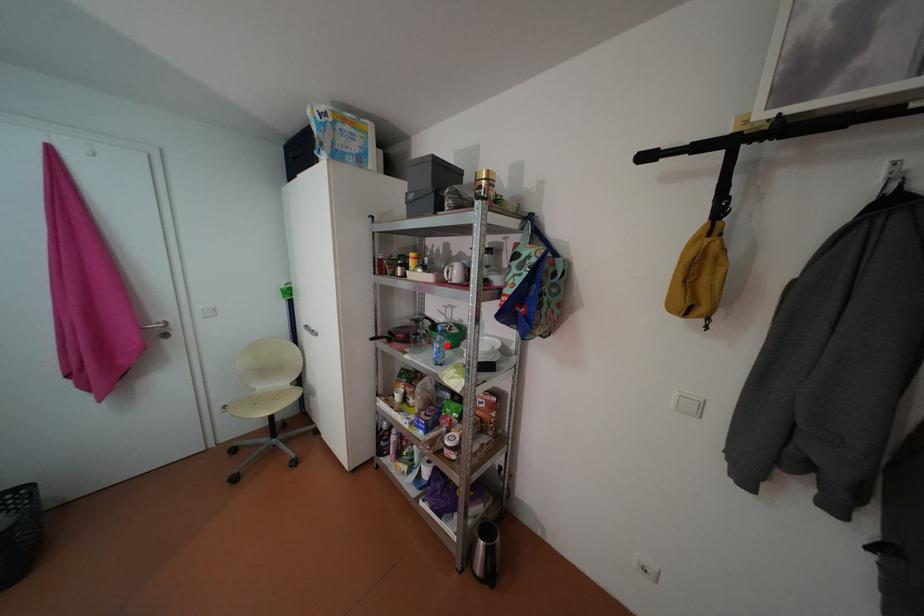
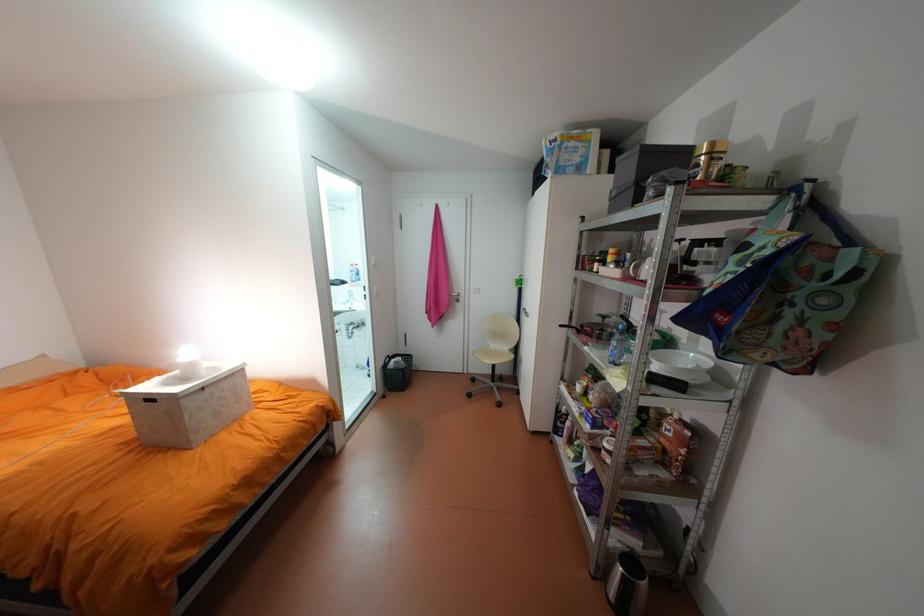
Find the pixel in the second image that matches the highlighted location in the first image.

(624, 342)